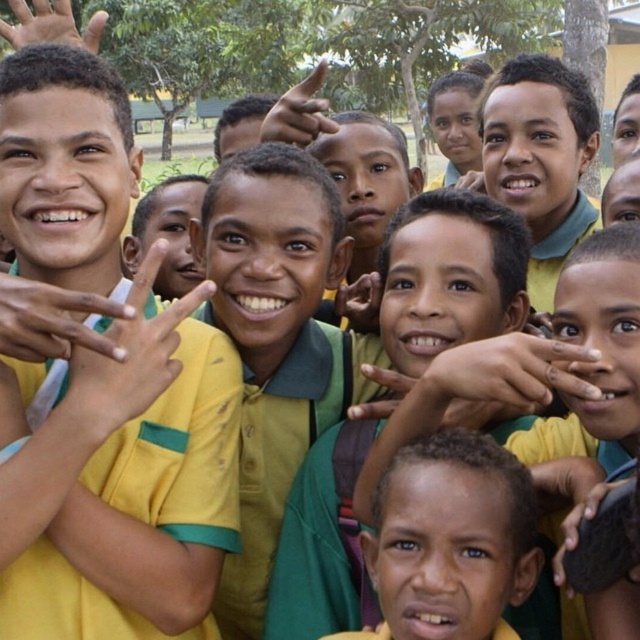
Which is in front, point (273, 342) or point (452, 163)?

Point (273, 342) is in front.

Is yellow-green shirt at center to the right of matte green shirt at center from the viewer's perspective?

In fact, yellow-green shirt at center is to the left of matte green shirt at center.

Is point (257, 371) positioned in front of point (445, 150)?

Yes, point (257, 371) is closer to viewer.

Identify the location of yellow-green shirt at center. The image size is (640, 640). (273, 340).

Between smooth skin hand at upper left and matte yellow hand at center, which one is positioned higher?

smooth skin hand at upper left is higher up.

Can you confirm if smooth skin hand at upper left is thinner than matte yellow hand at center?

No.

Is point (19, 33) positioned before point (371, 308)?

No, it is not.

Locate an element on the screen. The width and height of the screenshot is (640, 640). smooth skin hand at upper left is located at coordinates (51, 24).

Can you confirm if smooth skin hand at upper left is smaller than matte yellow hand at upper center?

No, smooth skin hand at upper left is not smaller than matte yellow hand at upper center.

This screenshot has width=640, height=640. Describe the element at coordinates (51, 24) in the screenshot. I see `smooth skin hand at upper left` at that location.

Between point (54, 12) and point (316, 76), which one is positioned in front?

Point (316, 76) is more forward.

Identify the location of smooth skin hand at upper left. The height and width of the screenshot is (640, 640). (51, 24).